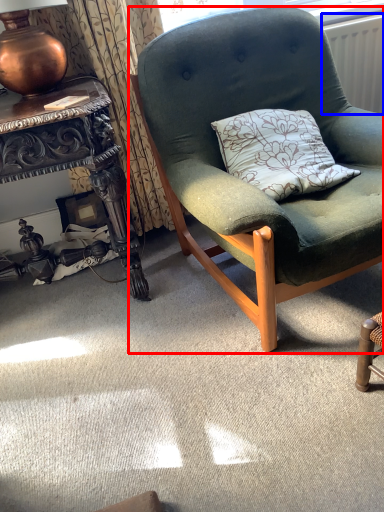
Question: Which object appears farthest to the camera in this image, chair (highlighted by a red box) or radiator (highlighted by a blue box)?

Choices:
 (A) chair
 (B) radiator

Answer: (B)